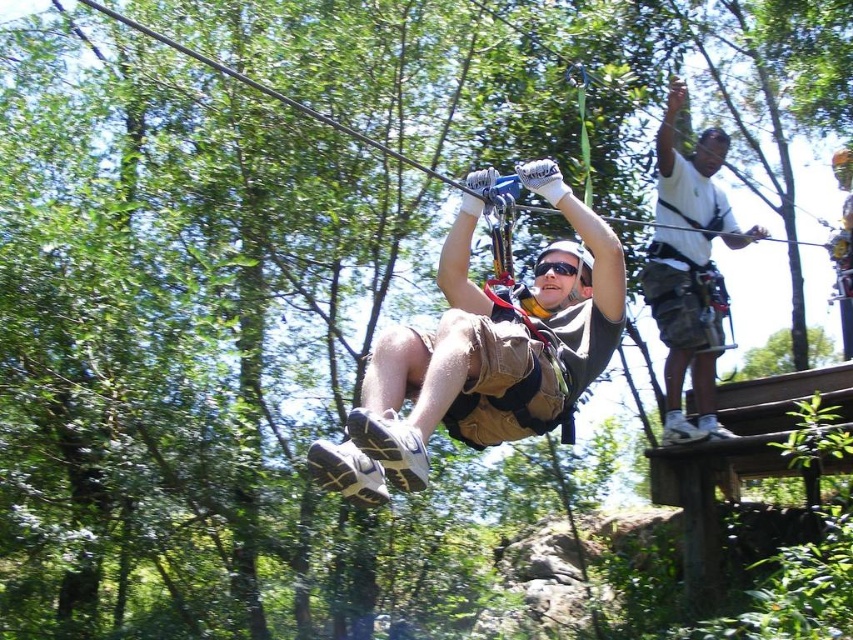
Question: Which of the following is the farthest from the observer?

Choices:
 (A) (540, 268)
 (B) (364, 442)
 (C) (654, 216)

Answer: (C)

Question: Observing the image, what is the correct spatial positioning of white cotton shirt at upper right in reference to black matte goggles at center?

Choices:
 (A) above
 (B) below

Answer: (A)

Question: Which of the following is the farthest from the observer?

Choices:
 (A) (479, 372)
 (B) (560, 262)

Answer: (B)

Question: Does tan fabric shorts at center appear on the left side of black matte goggles at center?

Choices:
 (A) yes
 (B) no

Answer: (A)

Question: Which of the following is the closest to the observer?

Choices:
 (A) white cotton shirt at upper right
 (B) tan fabric shorts at center
 (C) black matte goggles at center

Answer: (B)

Question: Is tan fabric shorts at center in front of black matte goggles at center?

Choices:
 (A) yes
 (B) no

Answer: (A)